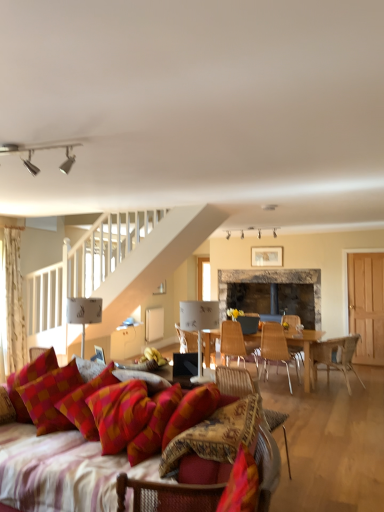
Question: Which is correct: wooden chair at center, which is the second chair from back to front, is inside wooden chair at center, placed as the 3th chair when sorted from back to front, or outside of it?

Choices:
 (A) inside
 (B) outside

Answer: (B)

Question: Is point (235, 337) positioned closer to the camera than point (261, 334)?

Choices:
 (A) farther
 (B) closer

Answer: (B)

Question: Which object is positioned farthest from the textured woven chair at lower left, the sixth chair when ordered from back to front?

Choices:
 (A) wooden chair at center, the 6th chair positioned from the front
 (B) rustic stone fireplace at center
 (C) wooden chair at right, which appears as the 3th chair when viewed from the front
 (D) silver metallic track lights at upper center, the 2th lamp viewed from the right
 (E) white paper lampshade at upper left, the first lamp in the bottom-to-top sequence

Answer: (B)

Question: Considering the real-world distances, which object is farthest from the wooden chair at center, the 6th chair positioned from the front?

Choices:
 (A) white textured curtain at left
 (B) rustic stone fireplace at center
 (C) white paper lampshade at upper left, which is counted as the 1th lamp, starting from the left
 (D) light brown wooden door at right
 (E) red checkered pillow at lower left

Answer: (E)